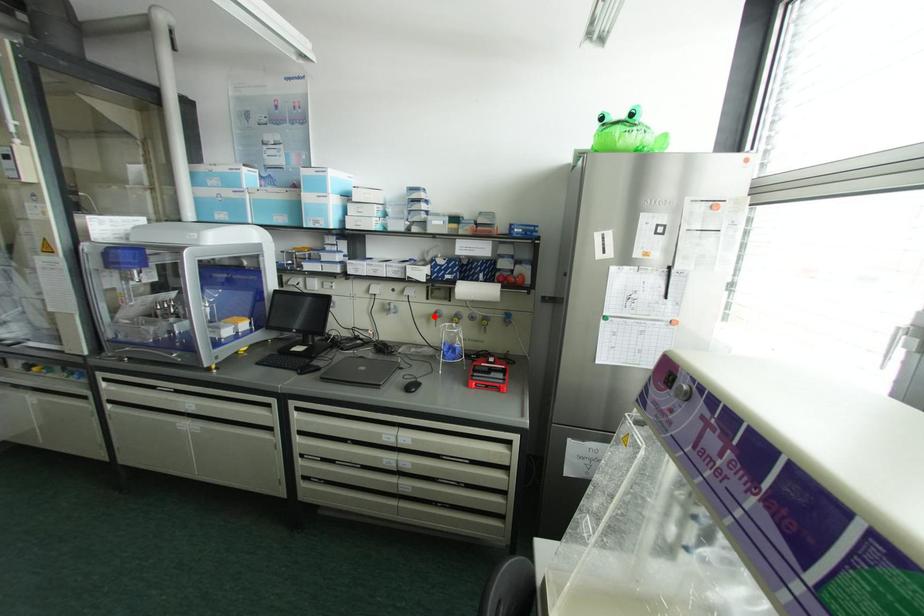
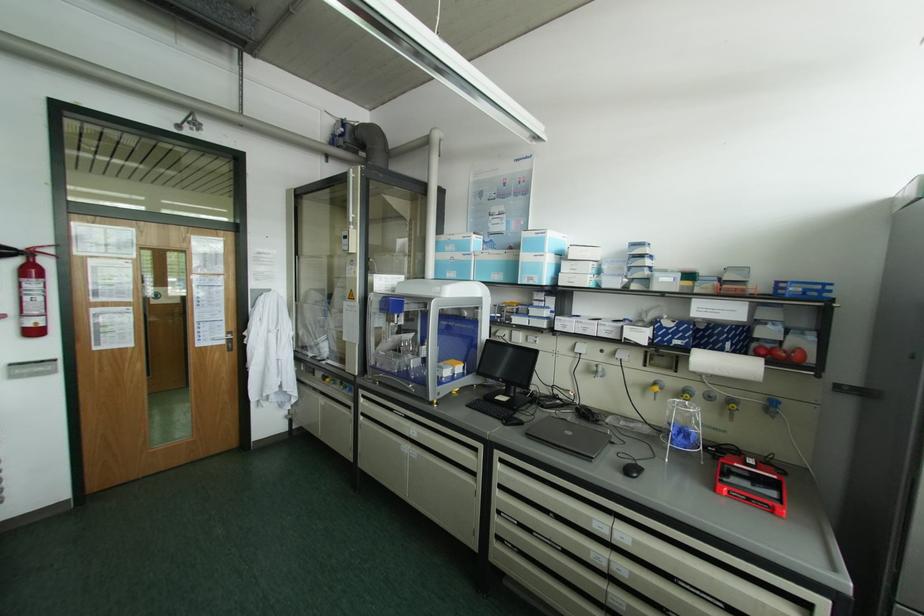
Locate, in the second image, the point that corresponds to the highlighted location in the first image.

(655, 387)